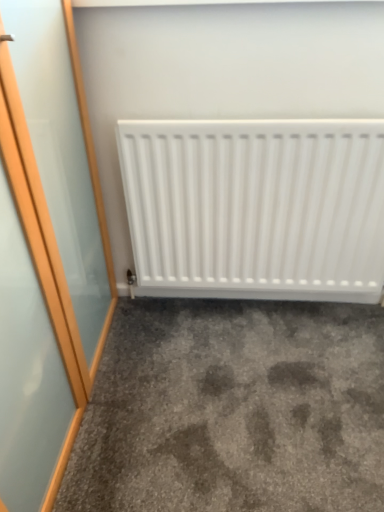
Question: Considering the positions of point (223, 198) and point (115, 400), is point (223, 198) closer or farther from the camera than point (115, 400)?

Choices:
 (A) closer
 (B) farther

Answer: (B)

Question: Is white matte radiator at center wider or thinner than gray carpet at lower center?

Choices:
 (A) wide
 (B) thin

Answer: (B)

Question: Considering their positions, is white matte radiator at center located in front of or behind gray carpet at lower center?

Choices:
 (A) behind
 (B) front

Answer: (A)

Question: Is point (61, 501) closer or farther from the camera than point (360, 263)?

Choices:
 (A) closer
 (B) farther

Answer: (A)

Question: Considering the relative positions of gray carpet at lower center and white matte radiator at center in the image provided, is gray carpet at lower center to the left or to the right of white matte radiator at center?

Choices:
 (A) left
 (B) right

Answer: (A)

Question: Which is correct: gray carpet at lower center is inside white matte radiator at center, or outside of it?

Choices:
 (A) outside
 (B) inside

Answer: (A)

Question: Looking at their shapes, would you say gray carpet at lower center is wider or thinner than white matte radiator at center?

Choices:
 (A) thin
 (B) wide

Answer: (B)